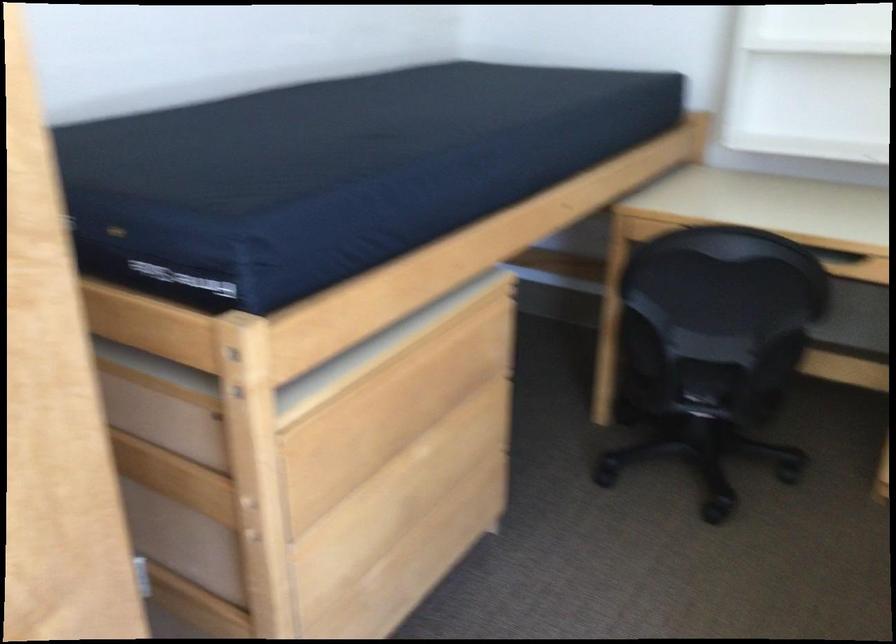
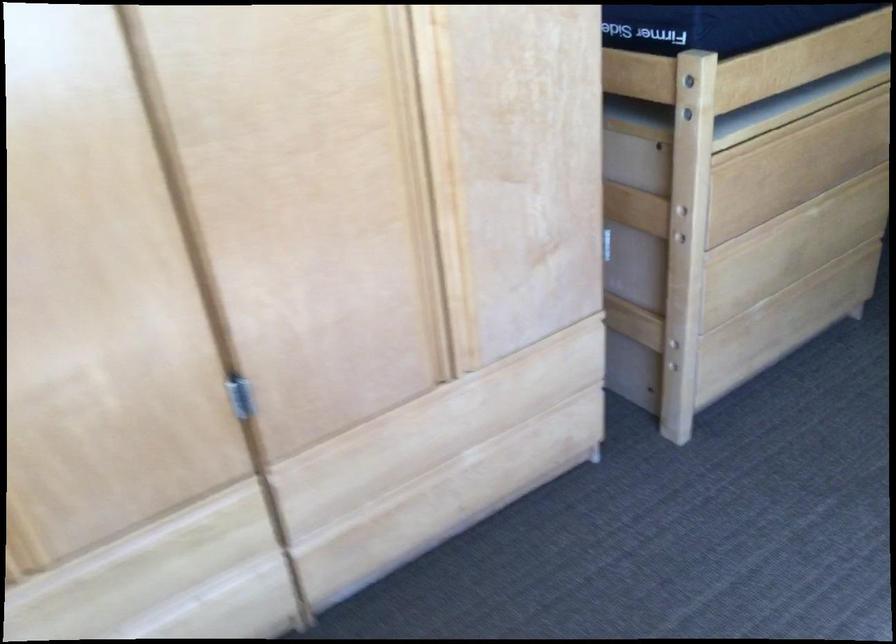
Locate, in the second image, the point that corresponds to [246,402] in the first image.

(688, 116)